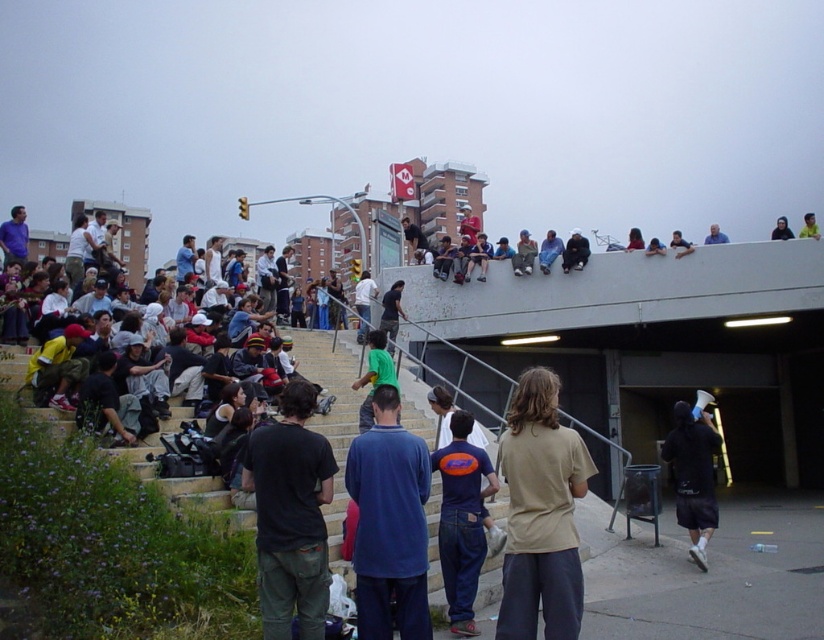
Question: Can you confirm if black cotton t-shirt at lower left is wider than dark blue shorts at lower right?

Choices:
 (A) yes
 (B) no

Answer: (B)

Question: Among these objects, which one is nearest to the camera?

Choices:
 (A) blue cotton shirt at center
 (B) black cotton t-shirt at lower left

Answer: (B)

Question: Is beige cotton shirt at center above dark blue shorts at lower right?

Choices:
 (A) yes
 (B) no

Answer: (A)

Question: Which is farther from the blue denim jeans at center?

Choices:
 (A) dark blue shorts at lower right
 (B) green fabric shirt at center

Answer: (B)

Question: Does blue denim jeans at center have a greater width compared to green t-shirt at center?

Choices:
 (A) yes
 (B) no

Answer: (A)

Question: Based on their relative distances, which object is farther from the beige cotton shirt at center?

Choices:
 (A) blue cotton shirt at center
 (B) green t-shirt at center

Answer: (B)